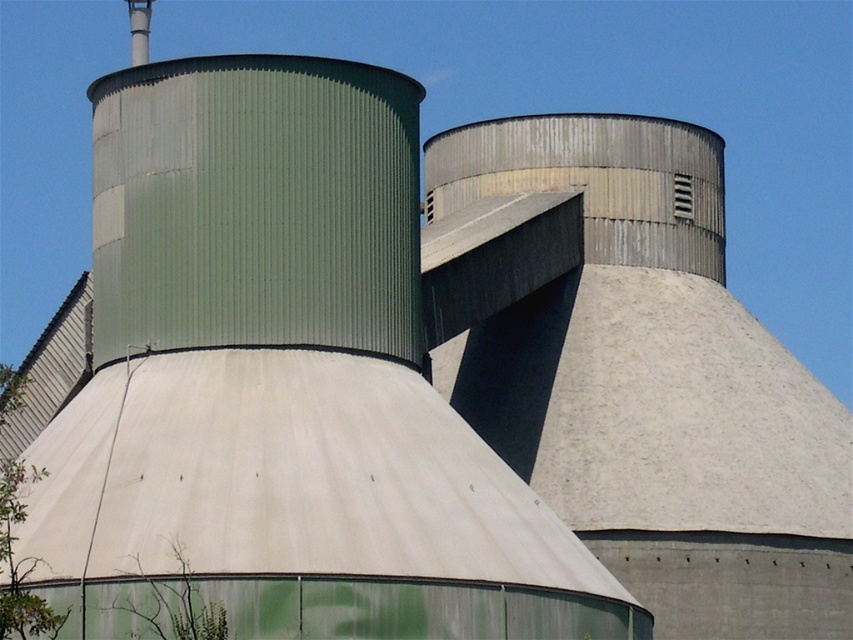
Is green corrugated metal plant at lower left shorter than green matte plant at lower left?

No, green corrugated metal plant at lower left is not shorter than green matte plant at lower left.

Which is more to the left, green corrugated metal plant at lower left or green matte plant at lower left?

From the viewer's perspective, green corrugated metal plant at lower left appears more on the left side.

Between point (0, 522) and point (131, 612), which one is positioned behind?

Point (131, 612)

The image size is (853, 640). I want to click on green corrugated metal plant at lower left, so click(x=20, y=563).